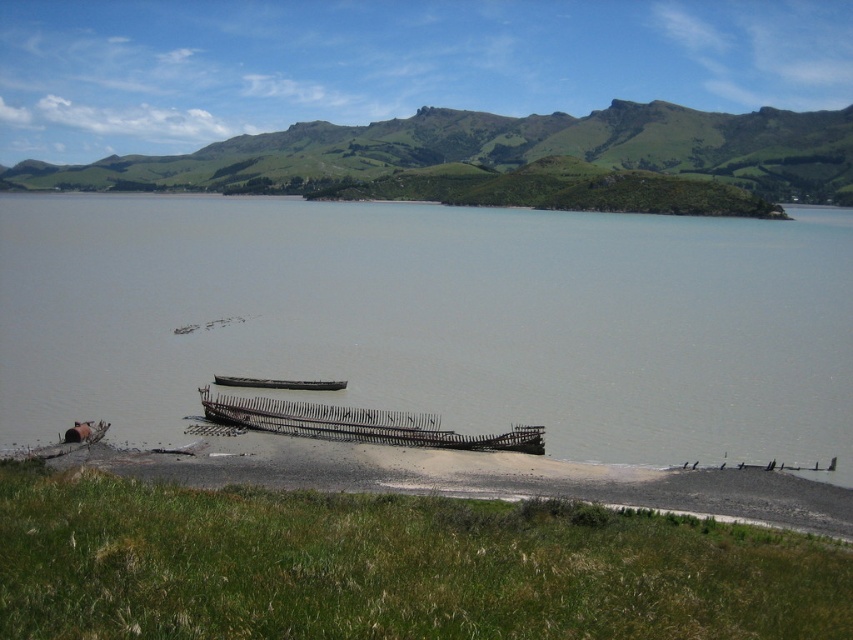
Question: Which point appears farthest from the camera in this image?

Choices:
 (A) (271, 420)
 (B) (265, 384)
 (C) (170, 220)
 (D) (688, 488)

Answer: (C)

Question: Which object is positioned closest to the wooden boat at center?

Choices:
 (A) rusty metal shipwreck at lower left
 (B) gray matte water at center
 (C) rusty metal boat at center

Answer: (C)

Question: Does rusty metal boat at center appear on the right side of wooden boat at center?

Choices:
 (A) yes
 (B) no

Answer: (A)

Question: Is gray matte water at center positioned behind wooden boat at center?

Choices:
 (A) yes
 (B) no

Answer: (B)

Question: Is gray matte water at center above rusty metal boat at center?

Choices:
 (A) yes
 (B) no

Answer: (A)

Question: Which point appears farthest from the camera in this image?

Choices:
 (A) (230, 417)
 (B) (28, 237)

Answer: (B)